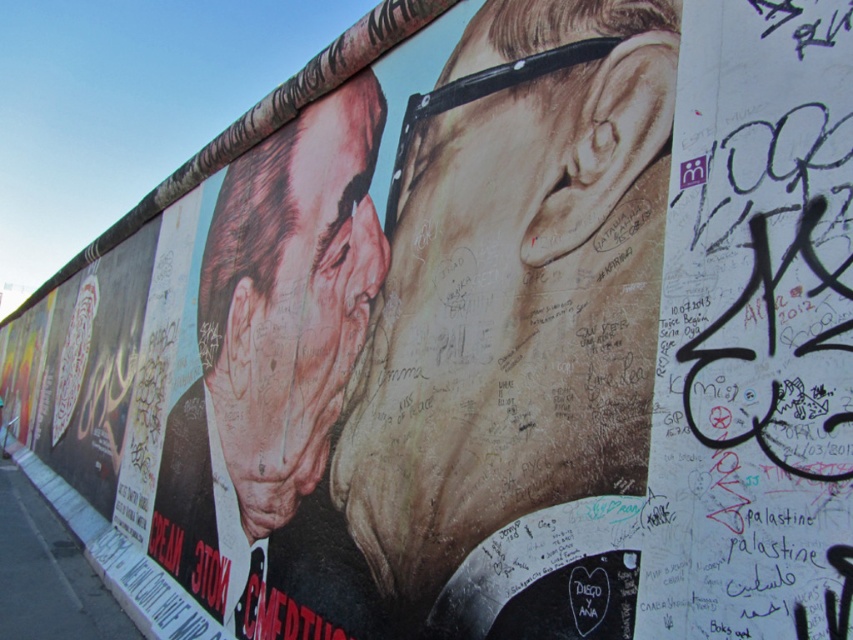
In the scene shown: Does matte brown face at center have a lesser height compared to black graffiti at right?

Incorrect, matte brown face at center's height does not fall short of black graffiti at right's.

Which is in front, point (525, 104) or point (683, 145)?

Point (683, 145) is in front.

Locate an element on the screen. This screenshot has height=640, width=853. matte brown face at center is located at coordinates (517, 330).

Does matte brown face at center come in front of matte black face at left?

Yes, matte brown face at center is closer to the viewer.

Does matte brown face at center have a smaller size compared to matte black face at left?

Yes.

Is point (587, 285) in front of point (286, 196)?

Yes, point (587, 285) is closer to viewer.

Identify the location of matte brown face at center. (517, 330).

Which is more to the right, black graffiti at right or matte black face at left?

black graffiti at right is more to the right.

This screenshot has height=640, width=853. Find the location of `black graffiti at right`. black graffiti at right is located at coordinates (753, 332).